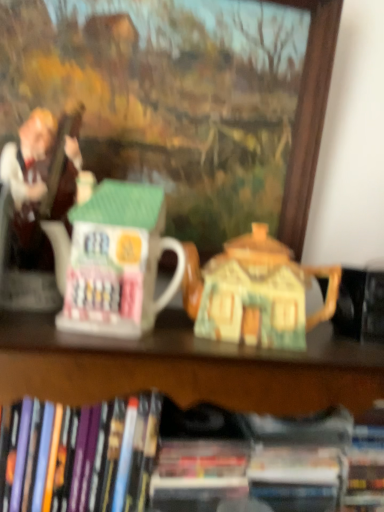
You are a GUI agent. You are given a task and a screenshot of the screen. Output one action in this format:
    pyautogui.click(x=<x>, y=<y>)
    Task: Click on the hardcover book at lower center, the first book when ordered from right to left
    Image resolution: width=384 pixels, height=512 pixels.
    Given the screenshot: What is the action you would take?
    pyautogui.click(x=222, y=456)

This screenshot has width=384, height=512. Identify the location of matte brown statue at left. (41, 180).

What do you see at coordinates (41, 180) in the screenshot?
I see `matte brown statue at left` at bounding box center [41, 180].

Image resolution: width=384 pixels, height=512 pixels. Describe the element at coordinates (114, 260) in the screenshot. I see `white glossy house-shaped mug at center` at that location.

Locate an element on the screen. The image size is (384, 512). matte ceramic teapot at center is located at coordinates (254, 292).

Based on the photo, measure the distance from hardcover book at lower center, the first book when ordered from right to left, to hardcover book at lower left, the first book when ordered from left to right.

hardcover book at lower center, the first book when ordered from right to left, is 7.66 centimeters away from hardcover book at lower left, the first book when ordered from left to right.

Which is in front, point (143, 435) or point (100, 434)?

The point (100, 434) is more forward.

Which is more to the left, hardcover book at lower center, which is counted as the second book, starting from the left, or hardcover book at lower left, the first book when ordered from left to right?

hardcover book at lower left, the first book when ordered from left to right, is more to the left.

Which is more to the right, matte ceramic teapot at center or matte brown statue at left?

Positioned to the right is matte ceramic teapot at center.

From the image's perspective, is matte ceramic teapot at center over matte brown statue at left?

Actually, matte ceramic teapot at center appears below matte brown statue at left in the image.

Is matte ceramic teapot at center positioned far away from matte brown statue at left?

No, matte ceramic teapot at center is in close proximity to matte brown statue at left.

Is matte ceramic teapot at center located outside matte brown statue at left?

matte ceramic teapot at center lies outside matte brown statue at left's area.

Does matte ceramic house at center have a lesser height compared to white glossy house-shaped mug at center?

Incorrect, the height of matte ceramic house at center does not fall short of that of white glossy house-shaped mug at center.

Is matte ceramic house at center placed right next to white glossy house-shaped mug at center?

matte ceramic house at center and white glossy house-shaped mug at center are clearly separated.

I want to click on toy below the matte ceramic house at center (from the image's perspective), so coord(114,260).

Considering the points (297, 177) and (108, 280), which point is in front, point (297, 177) or point (108, 280)?

The point (108, 280) is closer.

Considering the relative sizes of hardcover book at lower left, which is the second book in right-to-left order, and white glossy house-shaped mug at center in the image provided, is hardcover book at lower left, which is the second book in right-to-left order, thinner than white glossy house-shaped mug at center?

In fact, hardcover book at lower left, which is the second book in right-to-left order, might be wider than white glossy house-shaped mug at center.

Would you say hardcover book at lower left, which is the second book in right-to-left order, contains white glossy house-shaped mug at center?

No, white glossy house-shaped mug at center is not a part of hardcover book at lower left, which is the second book in right-to-left order.

Can you confirm if hardcover book at lower left, which is the second book in right-to-left order, is smaller than white glossy house-shaped mug at center?

Incorrect, hardcover book at lower left, which is the second book in right-to-left order, is not smaller in size than white glossy house-shaped mug at center.

Which is correct: matte brown statue at left is inside hardcover book at lower center, the first book when ordered from right to left, or outside of it?

matte brown statue at left is outside hardcover book at lower center, the first book when ordered from right to left.

Where is `person that is on the left side of hardcover book at lower center, the first book when ordered from right to left`? The height and width of the screenshot is (512, 384). person that is on the left side of hardcover book at lower center, the first book when ordered from right to left is located at coordinates (41, 180).

Which object is further away from the camera, matte brown statue at left or hardcover book at lower center, which is counted as the second book, starting from the left?

hardcover book at lower center, which is counted as the second book, starting from the left, is further away from the camera.

Is matte brown statue at left aimed at hardcover book at lower center, which is counted as the second book, starting from the left?

No, matte brown statue at left does not turn towards hardcover book at lower center, which is counted as the second book, starting from the left.

Relative to hardcover book at lower left, the first book when ordered from left to right, is white glossy house-shaped mug at center in front or behind?

Clearly, white glossy house-shaped mug at center is in front of hardcover book at lower left, the first book when ordered from left to right.

From a real-world perspective, is white glossy house-shaped mug at center physically above hardcover book at lower left, the first book when ordered from left to right?

Yes, from a real-world perspective, white glossy house-shaped mug at center is on top of hardcover book at lower left, the first book when ordered from left to right.

How many degrees apart are the facing directions of white glossy house-shaped mug at center and hardcover book at lower left, which is the second book in right-to-left order?

The facing directions of white glossy house-shaped mug at center and hardcover book at lower left, which is the second book in right-to-left order, are 10.8 degrees apart.

Which of these two, white glossy house-shaped mug at center or hardcover book at lower left, the first book when ordered from left to right, is bigger?

Bigger between the two is hardcover book at lower left, the first book when ordered from left to right.

You are a GUI agent. You are given a task and a screenshot of the screen. Output one action in this format:
    pyautogui.click(x=<x>, y=<y>)
    Task: Click on the teapot to the right of white glossy house-shaped mug at center
    The height and width of the screenshot is (512, 384).
    Given the screenshot: What is the action you would take?
    pyautogui.click(x=254, y=292)

Is white glossy house-shaped mug at center oriented away from matte ceramic teapot at center?

No, white glossy house-shaped mug at center is not facing away from matte ceramic teapot at center.

From the image's perspective, would you say white glossy house-shaped mug at center is shown under matte ceramic teapot at center?

Actually, white glossy house-shaped mug at center appears above matte ceramic teapot at center in the image.

At what (x,y) coordinates should I click in order to perform the action: click on book lying below the hardcover book at lower left, the first book when ordered from left to right (from the image's perspective). Please return your answer as a coordinate pair (x, y). This screenshot has width=384, height=512. Looking at the image, I should click on (222, 456).

Where is `teapot that appears in front of the matte brown statue at left`? The width and height of the screenshot is (384, 512). teapot that appears in front of the matte brown statue at left is located at coordinates (254, 292).

Looking at the image, which one is located further to hardcover book at lower left, the first book when ordered from left to right, matte brown statue at left or matte ceramic teapot at center?

Among the two, matte brown statue at left is located further to hardcover book at lower left, the first book when ordered from left to right.

Estimate the real-world distances between objects in this image. Which object is further from hardcover book at lower left, the first book when ordered from left to right, matte ceramic house at center or matte ceramic teapot at center?

matte ceramic house at center.

Estimate the real-world distances between objects in this image. Which object is closer to matte ceramic teapot at center, matte brown statue at left or hardcover book at lower left, the first book when ordered from left to right?

Based on the image, hardcover book at lower left, the first book when ordered from left to right, appears to be nearer to matte ceramic teapot at center.

Considering their positions, is hardcover book at lower left, the first book when ordered from left to right, positioned further to matte ceramic house at center than white glossy house-shaped mug at center?

The object further to matte ceramic house at center is hardcover book at lower left, the first book when ordered from left to right.

Estimate the real-world distances between objects in this image. Which object is further from matte brown statue at left, hardcover book at lower left, which is the second book in right-to-left order, or hardcover book at lower center, the first book when ordered from right to left?

hardcover book at lower center, the first book when ordered from right to left, is further to matte brown statue at left.

Looking at this image, when comparing their distances from hardcover book at lower left, which is the second book in right-to-left order, does matte ceramic house at center or matte brown statue at left seem closer?

Among the two, matte brown statue at left is located nearer to hardcover book at lower left, which is the second book in right-to-left order.

From the image, which object appears to be nearer to matte ceramic teapot at center, matte ceramic house at center or hardcover book at lower center, the first book when ordered from right to left?

Based on the image, hardcover book at lower center, the first book when ordered from right to left, appears to be nearer to matte ceramic teapot at center.

When comparing their distances from hardcover book at lower left, the first book when ordered from left to right, does hardcover book at lower center, which is counted as the second book, starting from the left, or white glossy house-shaped mug at center seem further?

The object further to hardcover book at lower left, the first book when ordered from left to right, is white glossy house-shaped mug at center.

Identify the location of toy between matte ceramic house at center and hardcover book at lower center, the first book when ordered from right to left, in the up-down direction. The width and height of the screenshot is (384, 512). (114, 260).

This screenshot has height=512, width=384. In order to click on toy between matte brown statue at left and hardcover book at lower center, which is counted as the second book, starting from the left, from top to bottom in this screenshot , I will do `click(114, 260)`.

This screenshot has height=512, width=384. I want to click on teapot between matte brown statue at left and hardcover book at lower center, the first book when ordered from right to left, in the vertical direction, so click(x=254, y=292).

Identify the location of teapot between hardcover book at lower left, which is the second book in right-to-left order, and hardcover book at lower center, which is counted as the second book, starting from the left. Image resolution: width=384 pixels, height=512 pixels. (254, 292).